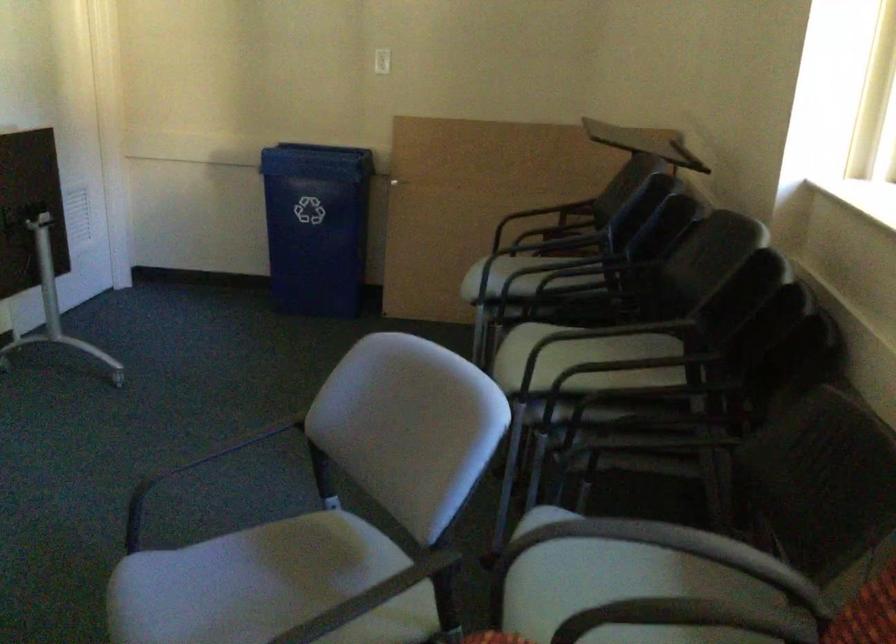
Find where to lift the blue recycling bin. Please return your answer as a coordinate pair (x, y).

(316, 225)